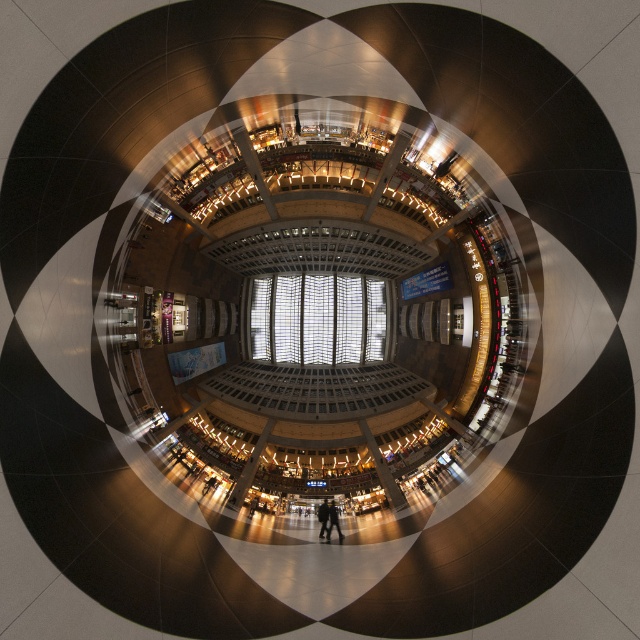
Is dark brown leather jacket at center further to the viewer compared to dark clothing at center?

No, it is in front of dark clothing at center.

Describe the element at coordinates (333, 522) in the screenshot. I see `dark brown leather jacket at center` at that location.

Find the location of a particular element. dark brown leather jacket at center is located at coordinates (333, 522).